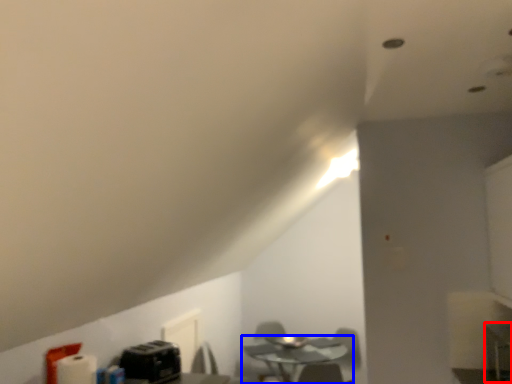
Question: Which point is further to the camera, computer desk (highlighted by a red box) or table (highlighted by a blue box)?

Choices:
 (A) computer desk
 (B) table

Answer: (B)